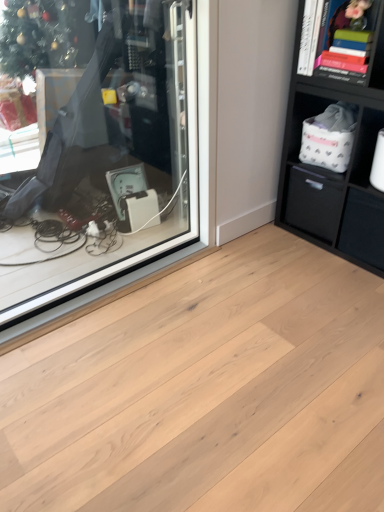
Question: Looking at their shapes, would you say hardcover book at upper right, placed as the second cabinet when sorted from right to left, is wider or thinner than white fabric basket at right, which is the second cabinet from top to bottom?

Choices:
 (A) wide
 (B) thin

Answer: (A)

Question: Is point (354, 27) positioned closer to the camera than point (349, 178)?

Choices:
 (A) closer
 (B) farther

Answer: (A)

Question: Which object is positioned farthest from the hardcover book at upper right, placed as the second cabinet when sorted from right to left?

Choices:
 (A) black fabric drawer at lower right, the 1th drawer when ordered from left to right
 (B) natural wood plank at center
 (C) white fabric basket at right, which is counted as the first cabinet, starting from the right
 (D) matte black drawer at lower right, the 1th drawer from the right
 (E) transparent glass shop window at upper left

Answer: (B)

Question: Which is nearer to the transparent glass shop window at upper left?

Choices:
 (A) hardcover book at upper right, placed as the second cabinet when sorted from right to left
 (B) black fabric drawer at lower right, the 1th drawer when ordered from left to right
 (C) natural wood plank at center
 (D) matte black drawer at lower right, the 2th drawer when ordered from left to right
 (E) white fabric basket at right, which is the second cabinet from top to bottom

Answer: (C)